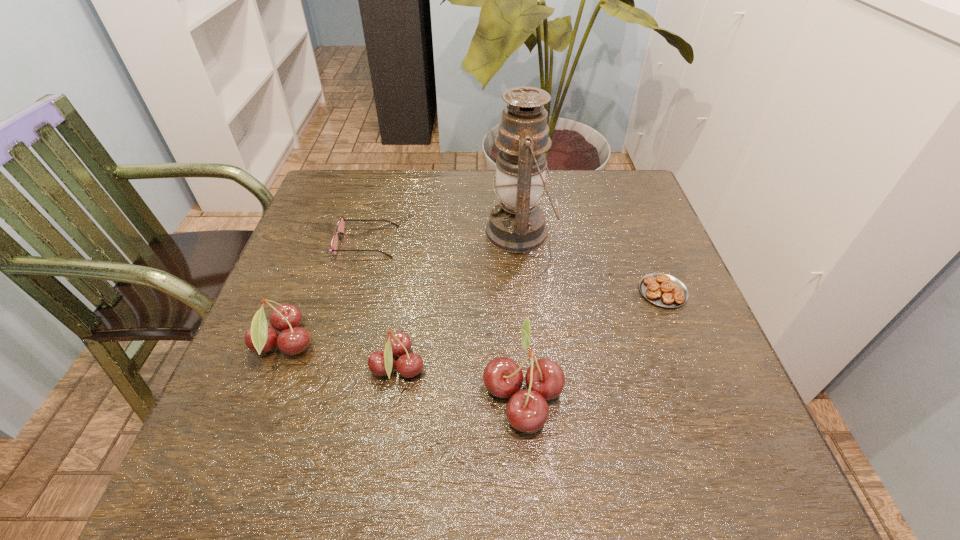
Identify the location of free space between the pastry and the rightmost cherry. This screenshot has height=540, width=960. (592, 342).

This screenshot has width=960, height=540. What are the coordinates of `vacant area between the rightmost cherry and the third object from left to right` in the screenshot? It's located at (460, 381).

The image size is (960, 540). Identify the location of free space between the pastry and the shortest cherry. (530, 330).

This screenshot has height=540, width=960. Find the location of `empty space that is in between the tallest object and the sunglasses`. empty space that is in between the tallest object and the sunglasses is located at coordinates (444, 237).

Find the location of a particular element. Image resolution: width=960 pixels, height=540 pixels. free space between the rightmost cherry and the tallest object is located at coordinates click(x=521, y=313).

Find the location of `free space between the pastry and the fourth shortest object`. free space between the pastry and the fourth shortest object is located at coordinates pos(473,318).

This screenshot has height=540, width=960. Identify the location of vacant area between the second shortest object and the rightmost cherry. (444, 318).

Locate an element on the screen. This screenshot has width=960, height=540. free space between the third farthest object and the tallest object is located at coordinates (591, 262).

You are a GUI agent. You are given a task and a screenshot of the screen. Output one action in this format:
    pyautogui.click(x=<x>, y=<y>)
    Task: Click on the free spot between the sunglasses and the leftmost cherry
    The image size is (960, 540).
    Given the screenshot: What is the action you would take?
    pyautogui.click(x=325, y=293)

Find the location of `object identified as the closest to the oil lamp`. object identified as the closest to the oil lamp is located at coordinates (664, 290).